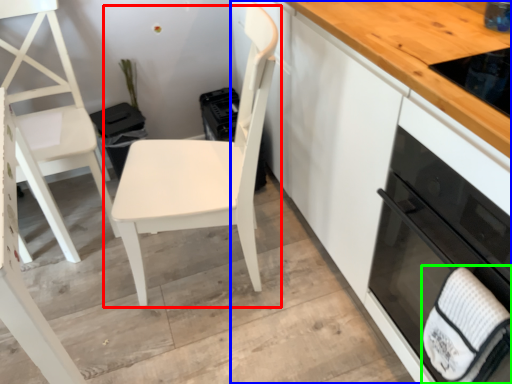
Question: Considering the real-world distances, which object is farthest from chair (highlighted by a red box)? cabinetry (highlighted by a blue box) or hand towel (highlighted by a green box)?

Choices:
 (A) cabinetry
 (B) hand towel

Answer: (B)